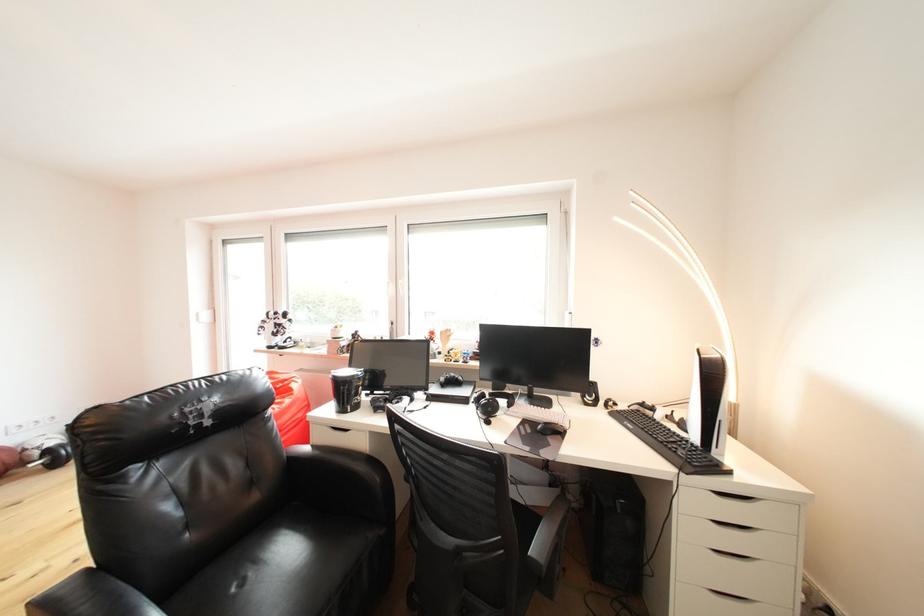
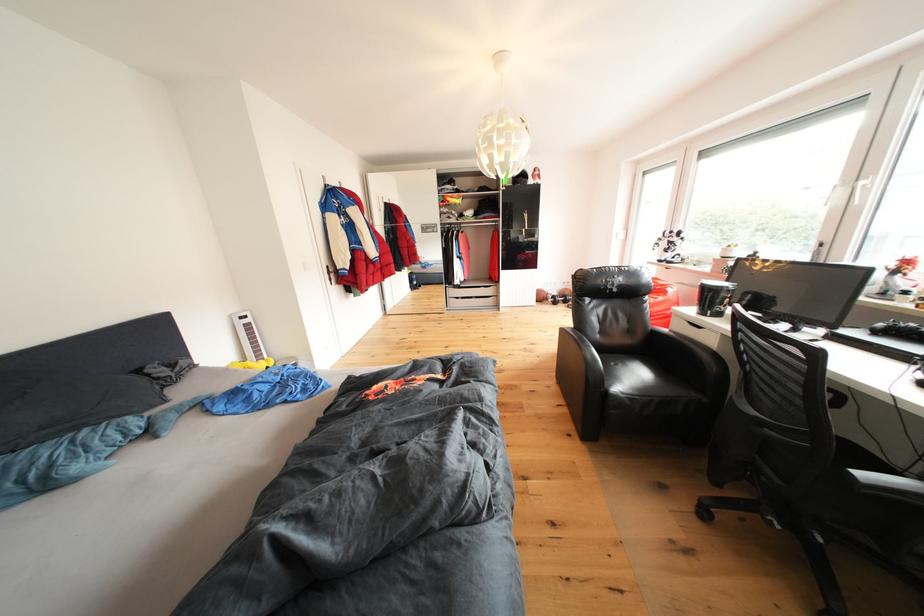
Locate, in the second image, the point that corresponds to (451,384) in the first image.

(890, 330)